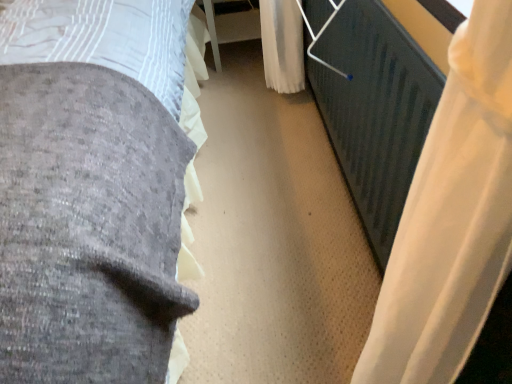
Question: Should I look upward or downward to see velvet gray bed at left?

Choices:
 (A) up
 (B) down

Answer: (A)

Question: Can you confirm if white sheer curtain at right is taller than white plastic table at center?

Choices:
 (A) yes
 (B) no

Answer: (A)

Question: From a real-world perspective, is white sheer curtain at right beneath white plastic table at center?

Choices:
 (A) no
 (B) yes

Answer: (A)

Question: Does white sheer curtain at right turn towards white plastic table at center?

Choices:
 (A) no
 (B) yes

Answer: (A)

Question: Is white sheer curtain at right at the right side of white plastic table at center?

Choices:
 (A) no
 (B) yes

Answer: (B)

Question: Does white sheer curtain at right appear on the left side of white plastic table at center?

Choices:
 (A) no
 (B) yes

Answer: (A)

Question: Is white plastic table at center at the back of white sheer curtain at right?

Choices:
 (A) no
 (B) yes

Answer: (A)

Question: Are white sheer curtain at right and velvet gray bed at left making contact?

Choices:
 (A) no
 (B) yes

Answer: (A)

Question: Considering the relative sizes of white sheer curtain at right and velvet gray bed at left in the image provided, is white sheer curtain at right taller than velvet gray bed at left?

Choices:
 (A) yes
 (B) no

Answer: (B)

Question: From the image's perspective, is white sheer curtain at right under velvet gray bed at left?

Choices:
 (A) yes
 (B) no

Answer: (A)

Question: From a real-world perspective, is white sheer curtain at right located higher than velvet gray bed at left?

Choices:
 (A) yes
 (B) no

Answer: (B)

Question: Does white sheer curtain at right come in front of velvet gray bed at left?

Choices:
 (A) no
 (B) yes

Answer: (A)

Question: From the image's perspective, is white sheer curtain at right above velvet gray bed at left?

Choices:
 (A) no
 (B) yes

Answer: (A)

Question: Is white plastic table at center located outside white sheer curtain at right?

Choices:
 (A) no
 (B) yes

Answer: (B)